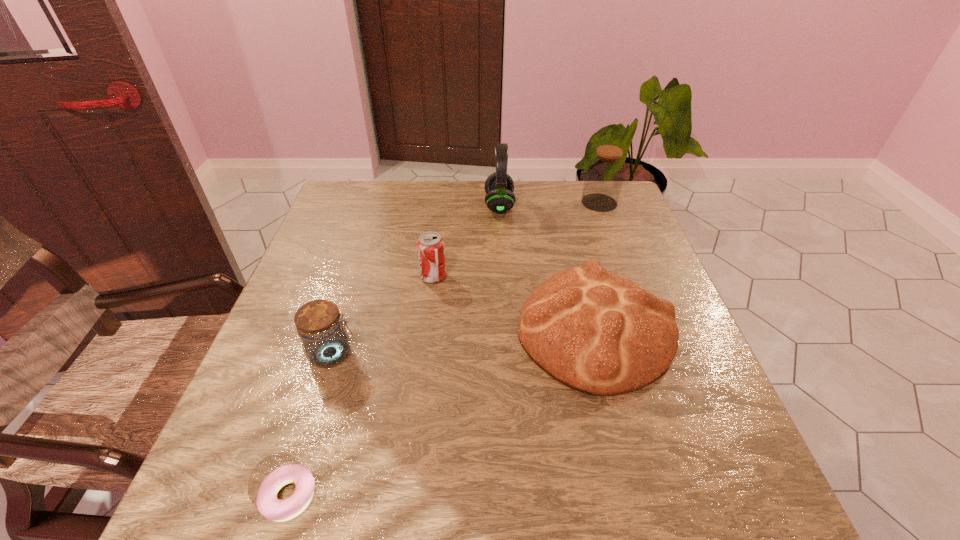
Where is `jar at the left edge`? The image size is (960, 540). jar at the left edge is located at coordinates (325, 342).

Where is `doughnut located at the left edge`? This screenshot has width=960, height=540. doughnut located at the left edge is located at coordinates (269, 506).

Where is `jar located in the right edge section of the desktop`? The height and width of the screenshot is (540, 960). jar located in the right edge section of the desktop is located at coordinates (605, 172).

The width and height of the screenshot is (960, 540). I want to click on bread located in the right edge section of the desktop, so click(599, 333).

Identify the location of object at the near left corner. (269, 506).

Locate an element on the screen. The image size is (960, 540). object located in the far right corner section of the desktop is located at coordinates (605, 172).

Locate an element on the screen. The height and width of the screenshot is (540, 960). vacant space at the far edge of the desktop is located at coordinates (455, 183).

This screenshot has width=960, height=540. Identify the location of free region at the near edge. (326, 483).

Image resolution: width=960 pixels, height=540 pixels. In the image, there is a desktop. Find the location of `vacant space at the left edge`. vacant space at the left edge is located at coordinates (363, 261).

The image size is (960, 540). Identify the location of vacant space at the right edge. (599, 233).